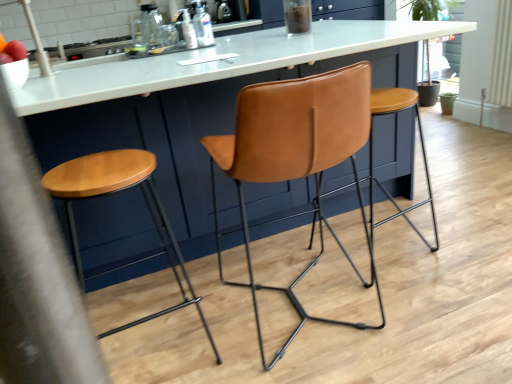
Question: From a real-world perspective, does transparent glass bottle at upper center, the first bottle viewed from the left, stand above translucent plastic bottle at upper center, the 2th bottle in the left-to-right sequence?

Choices:
 (A) no
 (B) yes

Answer: (B)

Question: Is the surface of transparent glass bottle at upper center, placed as the 3th bottle when sorted from front to back, in direct contact with translucent plastic bottle at upper center, which is the 1th bottle in front-to-back order?

Choices:
 (A) yes
 (B) no

Answer: (B)

Question: Is transparent glass bottle at upper center, the third bottle when ordered from right to left, further to the viewer compared to translucent plastic bottle at upper center, the third bottle viewed from the top?

Choices:
 (A) no
 (B) yes

Answer: (B)

Question: Does transparent glass bottle at upper center, marked as the 1th bottle in a top-to-bottom arrangement, have a greater width compared to translucent plastic bottle at upper center, the third bottle viewed from the top?

Choices:
 (A) yes
 (B) no

Answer: (A)

Question: Does transparent glass bottle at upper center, marked as the 1th bottle in a top-to-bottom arrangement, appear on the left side of translucent plastic bottle at upper center, which ranks as the third bottle in back-to-front order?

Choices:
 (A) yes
 (B) no

Answer: (A)

Question: Can you confirm if transparent glass bottle at upper center, the first bottle viewed from the left, is taller than translucent plastic bottle at upper center, which ranks as the third bottle in back-to-front order?

Choices:
 (A) no
 (B) yes

Answer: (B)

Question: Is translucent plastic bottle at upper center, which is the 1th bottle in front-to-back order, not near cognac leather chair at center?

Choices:
 (A) yes
 (B) no

Answer: (A)

Question: Is translucent plastic bottle at upper center, the 2th bottle in the left-to-right sequence, completely or partially outside of cognac leather chair at center?

Choices:
 (A) yes
 (B) no

Answer: (A)

Question: Is the surface of translucent plastic bottle at upper center, the 2th bottle in the right-to-left sequence, in direct contact with cognac leather chair at center?

Choices:
 (A) no
 (B) yes

Answer: (A)

Question: Does translucent plastic bottle at upper center, which ranks as the third bottle in back-to-front order, have a greater width compared to cognac leather chair at center?

Choices:
 (A) yes
 (B) no

Answer: (B)

Question: Is translucent plastic bottle at upper center, which is the 1th bottle in front-to-back order, shorter than cognac leather chair at center?

Choices:
 (A) yes
 (B) no

Answer: (A)

Question: Could you tell me if translucent plastic bottle at upper center, which ranks as the third bottle in back-to-front order, is facing cognac leather chair at center?

Choices:
 (A) yes
 (B) no

Answer: (B)

Question: From the image's perspective, is cognac leather chair at center above matte brown stool at center, which is the 2th stool in right-to-left order?

Choices:
 (A) no
 (B) yes

Answer: (B)